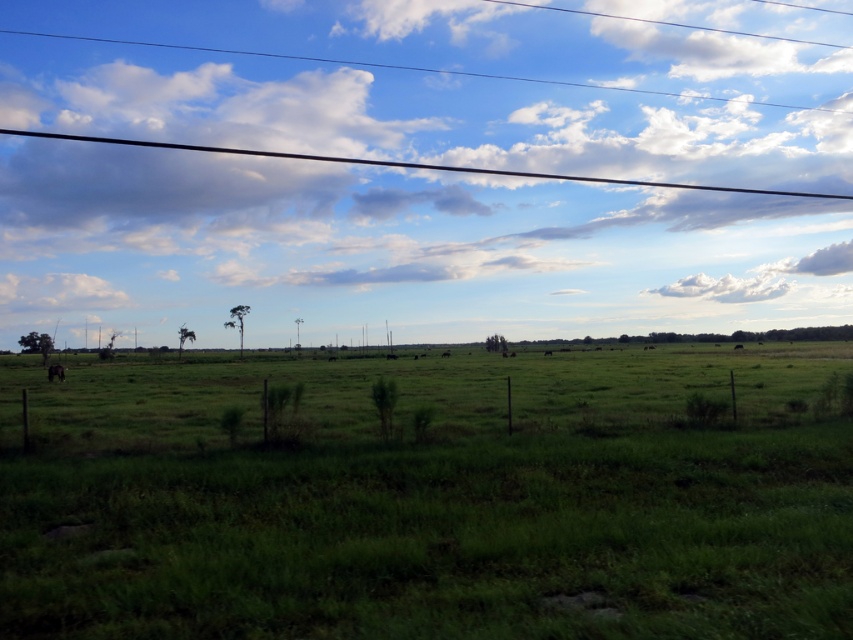
You are standing in the rural landscape and want to place a small flag at both point (70, 278) and point (62, 371). Which point is closer to your current position?

Point (62, 371) is closer to your current position because it is less further to the camera than point (70, 278).

You are standing in the middle of the grassy field and see the white fluffy cloud at upper left and the brown furry cow at lower left. Which object is located to the left of the other?

The white fluffy cloud at upper left is positioned on the left side of brown furry cow at lower left.